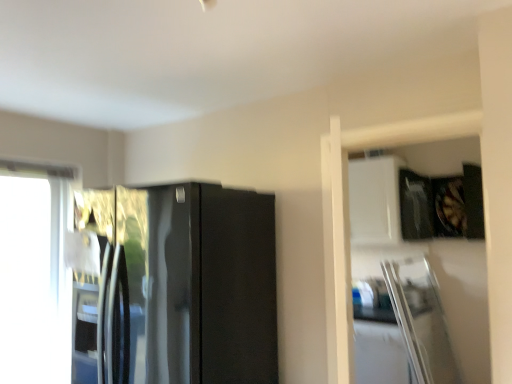
Question: Should I look upward or downward to see transparent glass window at left?

Choices:
 (A) down
 (B) up

Answer: (A)

Question: Are glossy black refrigerator at center and transparent glass window at left far apart?

Choices:
 (A) no
 (B) yes

Answer: (B)

Question: Could you tell me if glossy black refrigerator at center is facing transparent glass window at left?

Choices:
 (A) no
 (B) yes

Answer: (A)

Question: Is glossy black refrigerator at center turned away from transparent glass window at left?

Choices:
 (A) yes
 (B) no

Answer: (B)

Question: Is glossy black refrigerator at center to the right of transparent glass window at left from the viewer's perspective?

Choices:
 (A) yes
 (B) no

Answer: (A)

Question: Can you confirm if glossy black refrigerator at center is bigger than transparent glass window at left?

Choices:
 (A) no
 (B) yes

Answer: (B)

Question: Does glossy black refrigerator at center have a smaller size compared to transparent glass window at left?

Choices:
 (A) yes
 (B) no

Answer: (B)

Question: Is transparent glass window at left positioned before glossy black refrigerator at center?

Choices:
 (A) yes
 (B) no

Answer: (B)

Question: Is transparent glass window at left not inside glossy black refrigerator at center?

Choices:
 (A) yes
 (B) no

Answer: (A)

Question: From the image's perspective, does transparent glass window at left appear lower than glossy black refrigerator at center?

Choices:
 (A) no
 (B) yes

Answer: (B)

Question: Can you confirm if transparent glass window at left is taller than glossy black refrigerator at center?

Choices:
 (A) no
 (B) yes

Answer: (B)

Question: Does transparent glass window at left have a lesser width compared to glossy black refrigerator at center?

Choices:
 (A) yes
 (B) no

Answer: (A)

Question: Are transparent glass window at left and glossy black refrigerator at center far apart?

Choices:
 (A) yes
 (B) no

Answer: (A)

Question: Is point (42, 241) positioned closer to the camera than point (198, 332)?

Choices:
 (A) closer
 (B) farther

Answer: (B)